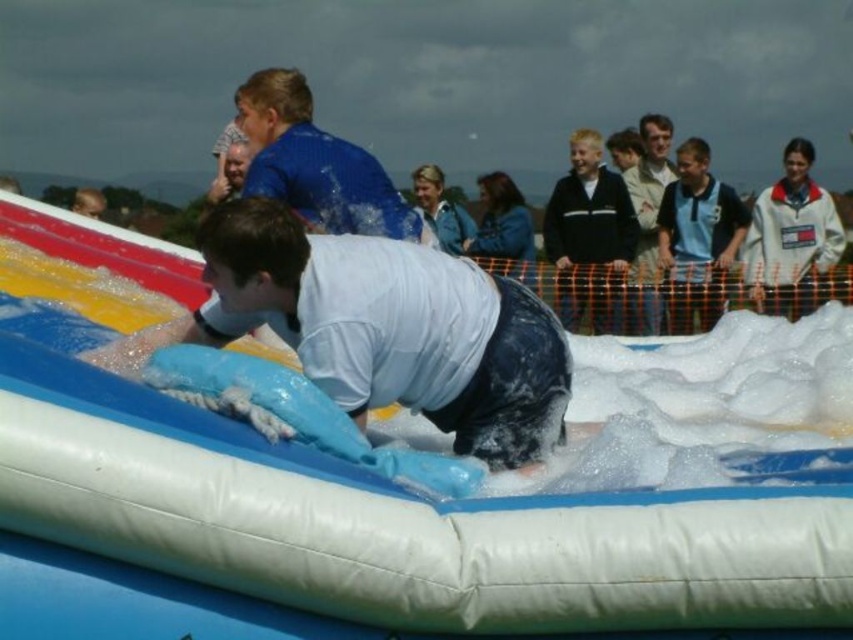
Question: Estimate the real-world distances between objects in this image. Which object is farther from the light brown leather jacket at upper center?

Choices:
 (A) blue smooth shirt at upper center
 (B) white matte shirt at center
 (C) black fleece jacket at upper right
 (D) blue jersey at upper right

Answer: (B)

Question: Can you confirm if white matte shirt at center is smaller than blue smooth shirt at upper center?

Choices:
 (A) yes
 (B) no

Answer: (A)

Question: Observing the image, what is the correct spatial positioning of black fleece jacket at upper right in reference to light brown leather jacket at upper center?

Choices:
 (A) right
 (B) left

Answer: (B)

Question: Which object is closer to the camera taking this photo?

Choices:
 (A) blue smooth shirt at upper center
 (B) blue jersey at upper right

Answer: (A)

Question: Is blue jersey at upper right closer to camera compared to light brown leather jacket at upper center?

Choices:
 (A) no
 (B) yes

Answer: (A)

Question: Which object is the farthest from the blue jersey at upper right?

Choices:
 (A) light brown leather jacket at upper center
 (B) black fleece jacket at upper right
 (C) white matte shirt at center

Answer: (C)